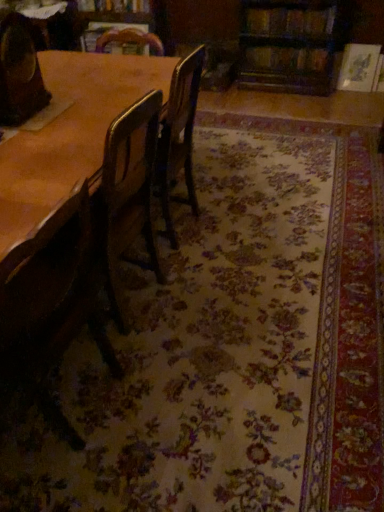
You are a GUI agent. You are given a task and a screenshot of the screen. Output one action in this format:
    pyautogui.click(x=<x>, y=<y>)
    Task: Click on the wooden chair at left, which is the second chair in bottom-to-top order
    This screenshot has height=512, width=384.
    Given the screenshot: What is the action you would take?
    pyautogui.click(x=19, y=72)

Image resolution: width=384 pixels, height=512 pixels. What do you see at coordinates (19, 72) in the screenshot?
I see `wooden chair at left, which is the first chair in top-to-bottom order` at bounding box center [19, 72].

Locate an element on the screen. Image resolution: width=384 pixels, height=512 pixels. wooden table at center is located at coordinates (70, 132).

The height and width of the screenshot is (512, 384). What do you see at coordinates (51, 301) in the screenshot?
I see `wooden chair at left, positioned as the 1th chair in bottom-to-top order` at bounding box center [51, 301].

I want to click on wooden chair at left, which is the first chair in top-to-bottom order, so click(19, 72).

Looking at their sizes, would you say wooden chair at left, which is the first chair in top-to-bottom order, is wider or thinner than hardcover book at upper center, marked as the 3th book in a bottom-to-top arrangement?

Clearly, wooden chair at left, which is the first chair in top-to-bottom order, has less width compared to hardcover book at upper center, marked as the 3th book in a bottom-to-top arrangement.

Is wooden chair at left, which is the second chair in bottom-to-top order, completely or partially outside of hardcover book at upper center, positioned as the first book in left-to-right order?

Yes, wooden chair at left, which is the second chair in bottom-to-top order, is located beyond the bounds of hardcover book at upper center, positioned as the first book in left-to-right order.

From a real-world perspective, relative to hardcover book at upper center, marked as the 3th book in a bottom-to-top arrangement, is wooden chair at left, which is the first chair in top-to-bottom order, vertically above or below?

wooden chair at left, which is the first chair in top-to-bottom order, is situated higher than hardcover book at upper center, marked as the 3th book in a bottom-to-top arrangement, in the real world.

Is wooden chair at left, which is the second chair in bottom-to-top order, bigger or smaller than hardcover book at upper center, marked as the 3th book in a bottom-to-top arrangement?

Considering their sizes, wooden chair at left, which is the second chair in bottom-to-top order, takes up more space than hardcover book at upper center, marked as the 3th book in a bottom-to-top arrangement.

In the image, is hardcover book at upper center, the first book positioned from the top, positioned in front of or behind hardcover book at upper right, the first book in the bottom-to-top sequence?

In the image, hardcover book at upper center, the first book positioned from the top, appears behind hardcover book at upper right, the first book in the bottom-to-top sequence.

Is hardcover book at upper center, positioned as the first book in left-to-right order, taller or shorter than hardcover book at upper right, the first book in the right-to-left sequence?

Considering their sizes, hardcover book at upper center, positioned as the first book in left-to-right order, has less height than hardcover book at upper right, the first book in the right-to-left sequence.

Is hardcover book at upper center, positioned as the first book in left-to-right order, positioned far away from hardcover book at upper right, the first book in the right-to-left sequence?

Indeed, hardcover book at upper center, positioned as the first book in left-to-right order, is not near hardcover book at upper right, the first book in the right-to-left sequence.

From a real-world perspective, is hardcover book at upper center, marked as the 3th book in a bottom-to-top arrangement, above or below hardcover book at upper right, acting as the third book starting from the left?

Clearly, from a real-world perspective, hardcover book at upper center, marked as the 3th book in a bottom-to-top arrangement, is above hardcover book at upper right, acting as the third book starting from the left.

Which object is positioned more to the right, wooden chair at left, acting as the 2th chair starting from the top, or wooden table at center?

Positioned to the right is wooden table at center.

Is wooden chair at left, positioned as the 1th chair in bottom-to-top order, oriented towards wooden table at center?

No, wooden chair at left, positioned as the 1th chair in bottom-to-top order, is not oriented towards wooden table at center.

Is point (47, 353) positioned behind point (38, 222)?

Yes, point (47, 353) is behind point (38, 222).

Between wooden chair at left, positioned as the 1th chair in bottom-to-top order, and wooden table at center, which one has smaller width?

wooden chair at left, positioned as the 1th chair in bottom-to-top order, is thinner.

Which of these two, hardcover book at upper center, placed as the second book when sorted from top to bottom, or wooden chair at left, positioned as the 1th chair in bottom-to-top order, stands taller?

With more height is wooden chair at left, positioned as the 1th chair in bottom-to-top order.

Is hardcover book at upper center, the 2th book positioned from the left, facing towards wooden chair at left, positioned as the 1th chair in bottom-to-top order?

Yes.

Are hardcover book at upper center, placed as the second book when sorted from top to bottom, and wooden chair at left, positioned as the 1th chair in bottom-to-top order, located far from each other?

hardcover book at upper center, placed as the second book when sorted from top to bottom, is far away from wooden chair at left, positioned as the 1th chair in bottom-to-top order.

Considering the relative sizes of wooden table at center and wooden chair at left, which is the second chair in bottom-to-top order, in the image provided, is wooden table at center taller than wooden chair at left, which is the second chair in bottom-to-top order,?

Correct, wooden table at center is much taller as wooden chair at left, which is the second chair in bottom-to-top order.

Considering the positions of objects wooden table at center and wooden chair at left, which is the second chair in bottom-to-top order, in the image provided, who is in front, wooden table at center or wooden chair at left, which is the second chair in bottom-to-top order,?

Positioned in front is wooden table at center.

Between point (6, 232) and point (8, 78), which one is positioned in front?

The point (6, 232) is closer to the camera.

Which object is positioned more to the right, wooden table at center or wooden chair at left, which is the first chair in top-to-bottom order?

wooden table at center is more to the right.

Is wooden chair at left, acting as the 2th chair starting from the top, wider than hardcover book at upper center, positioned as the first book in left-to-right order?

Yes.

Is the depth of wooden chair at left, positioned as the 1th chair in bottom-to-top order, less than that of hardcover book at upper center, marked as the 3th book in a bottom-to-top arrangement?

That is True.

Considering the relative positions of wooden chair at left, positioned as the 1th chair in bottom-to-top order, and hardcover book at upper center, marked as the 3th book in a bottom-to-top arrangement, in the image provided, is wooden chair at left, positioned as the 1th chair in bottom-to-top order, to the right of hardcover book at upper center, marked as the 3th book in a bottom-to-top arrangement, from the viewer's perspective?

Correct, you'll find wooden chair at left, positioned as the 1th chair in bottom-to-top order, to the right of hardcover book at upper center, marked as the 3th book in a bottom-to-top arrangement.

From the picture: Between wooden chair at left, positioned as the 1th chair in bottom-to-top order, and hardcover book at upper center, marked as the 3th book in a bottom-to-top arrangement, which one has smaller size?

With smaller size is hardcover book at upper center, marked as the 3th book in a bottom-to-top arrangement.

Between point (102, 142) and point (280, 69), which one is positioned behind?

The point (280, 69) is farther.

Between wooden table at center and hardcover book at upper right, placed as the 3th book when sorted from top to bottom, which one has smaller size?

Smaller between the two is hardcover book at upper right, placed as the 3th book when sorted from top to bottom.

From the image's perspective, would you say wooden table at center is positioned over hardcover book at upper right, the first book in the right-to-left sequence?

No.

The image size is (384, 512). I want to click on table that appears below the hardcover book at upper right, the first book in the bottom-to-top sequence (from the image's perspective), so click(x=70, y=132).

From the image's perspective, which book is the 3rd one above the wooden chair at left, which is the first chair in top-to-bottom order? Please provide its 2D coordinates.

[(115, 6)]

This screenshot has height=512, width=384. What are the coordinates of `the 2nd book positioned above the hardcover book at upper right, the first book in the bottom-to-top sequence (from a real-world perspective)` in the screenshot? It's located at (115, 6).

Based on their spatial positions, is wooden chair at left, acting as the 2th chair starting from the top, or hardcover book at upper center, which is counted as the second book, starting from the right, closer to hardcover book at upper center, the first book positioned from the top?

hardcover book at upper center, which is counted as the second book, starting from the right, lies closer to hardcover book at upper center, the first book positioned from the top, than the other object.

Which object lies nearer to the anchor point hardcover book at upper right, acting as the third book starting from the left, wooden chair at left, which is the first chair in top-to-bottom order, or wooden table at center?

wooden table at center is positioned closer to the anchor hardcover book at upper right, acting as the third book starting from the left.

Based on their spatial positions, is hardcover book at upper center, which is counted as the second book, starting from the right, or hardcover book at upper right, the first book in the right-to-left sequence, closer to wooden chair at left, which is the first chair in top-to-bottom order?

Based on the image, hardcover book at upper center, which is counted as the second book, starting from the right, appears to be nearer to wooden chair at left, which is the first chair in top-to-bottom order.

Which object lies nearer to the anchor point hardcover book at upper right, the first book in the right-to-left sequence, wooden table at center or hardcover book at upper center, placed as the second book when sorted from top to bottom?

Among the two, hardcover book at upper center, placed as the second book when sorted from top to bottom, is located nearer to hardcover book at upper right, the first book in the right-to-left sequence.

From the picture: Considering their positions, is wooden table at center positioned further to wooden chair at left, acting as the 2th chair starting from the top, than wooden chair at left, which is the second chair in bottom-to-top order?

wooden chair at left, which is the second chair in bottom-to-top order, is further to wooden chair at left, acting as the 2th chair starting from the top.

Considering their positions, is wooden chair at left, acting as the 2th chair starting from the top, positioned closer to wooden chair at left, which is the second chair in bottom-to-top order, than hardcover book at upper center, which is counted as the second book, starting from the right?

wooden chair at left, acting as the 2th chair starting from the top, lies closer to wooden chair at left, which is the second chair in bottom-to-top order, than the other object.

Looking at the image, which one is located closer to hardcover book at upper center, placed as the second book when sorted from top to bottom, wooden chair at left, which is the second chair in bottom-to-top order, or hardcover book at upper right, the first book in the bottom-to-top sequence?

hardcover book at upper right, the first book in the bottom-to-top sequence, lies closer to hardcover book at upper center, placed as the second book when sorted from top to bottom, than the other object.

Based on their spatial positions, is wooden chair at left, which is the second chair in bottom-to-top order, or wooden chair at left, positioned as the 1th chair in bottom-to-top order, closer to hardcover book at upper center, which is counted as the third book, starting from the right?

The object closer to hardcover book at upper center, which is counted as the third book, starting from the right, is wooden chair at left, which is the second chair in bottom-to-top order.

Find the location of a particular element. book between hardcover book at upper center, positioned as the first book in left-to-right order, and hardcover book at upper right, the first book in the right-to-left sequence is located at coordinates (289, 21).

Where is `book located between wooden chair at left, acting as the 2th chair starting from the top, and hardcover book at upper right, acting as the third book starting from the left, in the depth direction`? Image resolution: width=384 pixels, height=512 pixels. book located between wooden chair at left, acting as the 2th chair starting from the top, and hardcover book at upper right, acting as the third book starting from the left, in the depth direction is located at coordinates (289, 21).

I want to click on table between wooden chair at left, which is the first chair in top-to-bottom order, and wooden chair at left, acting as the 2th chair starting from the top, in the vertical direction, so click(70, 132).

Find the location of a particular element. Image resolution: width=384 pixels, height=512 pixels. chair between wooden chair at left, positioned as the 1th chair in bottom-to-top order, and hardcover book at upper center, the 2th book positioned from the left, along the z-axis is located at coordinates (19, 72).